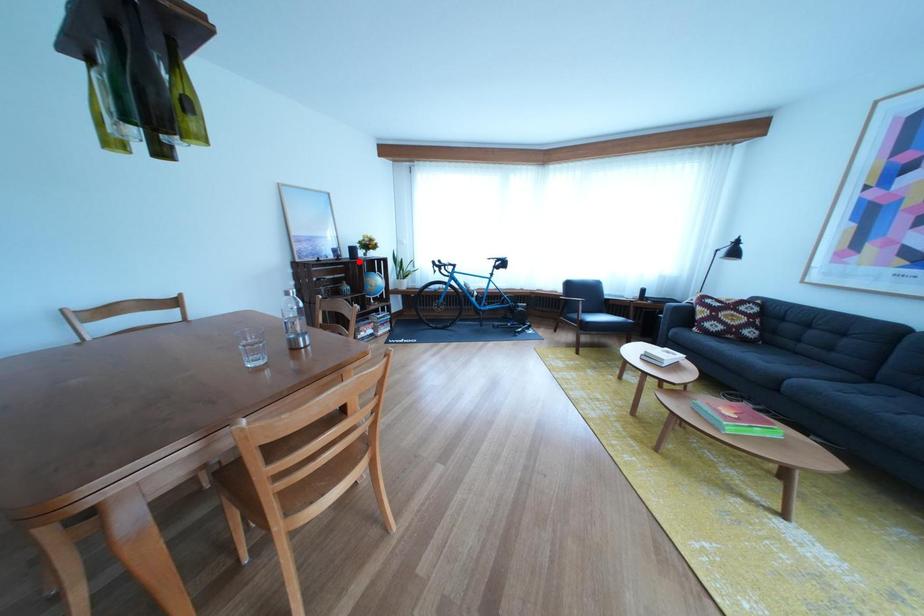
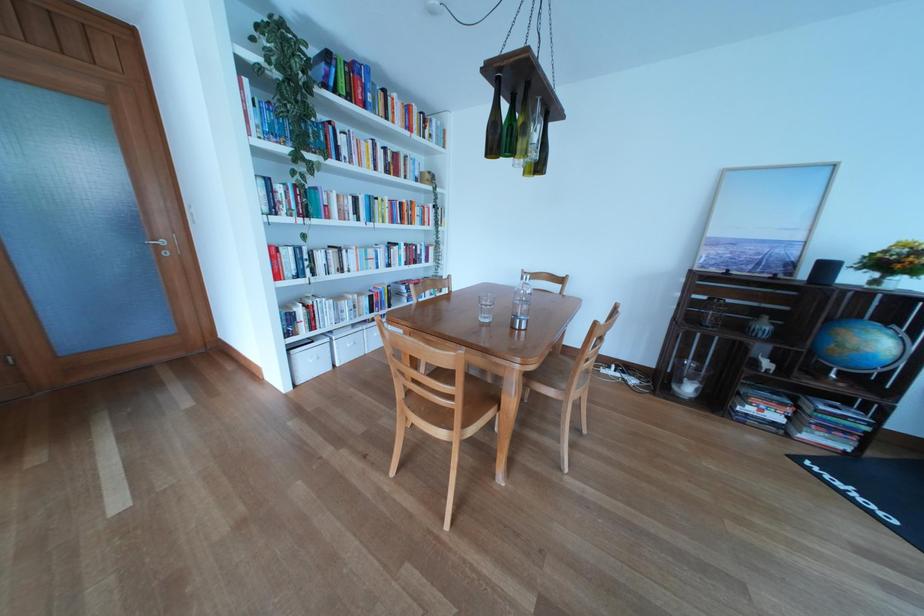
Locate, in the second image, the point that corresponds to the highlighted location in the first image.

(816, 282)